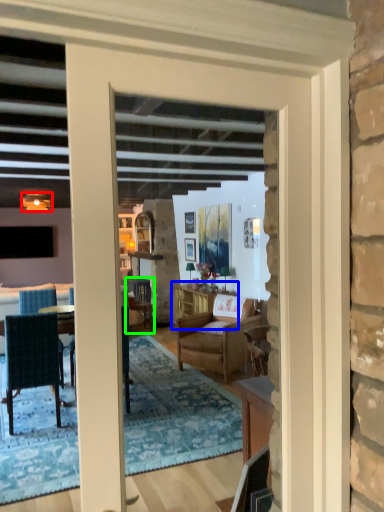
Question: Based on their relative distances, which object is farther from lamp (highlighted by a red box)? Choose from cabinetry (highlighted by a blue box) and chair (highlighted by a green box).

Choices:
 (A) cabinetry
 (B) chair

Answer: (A)